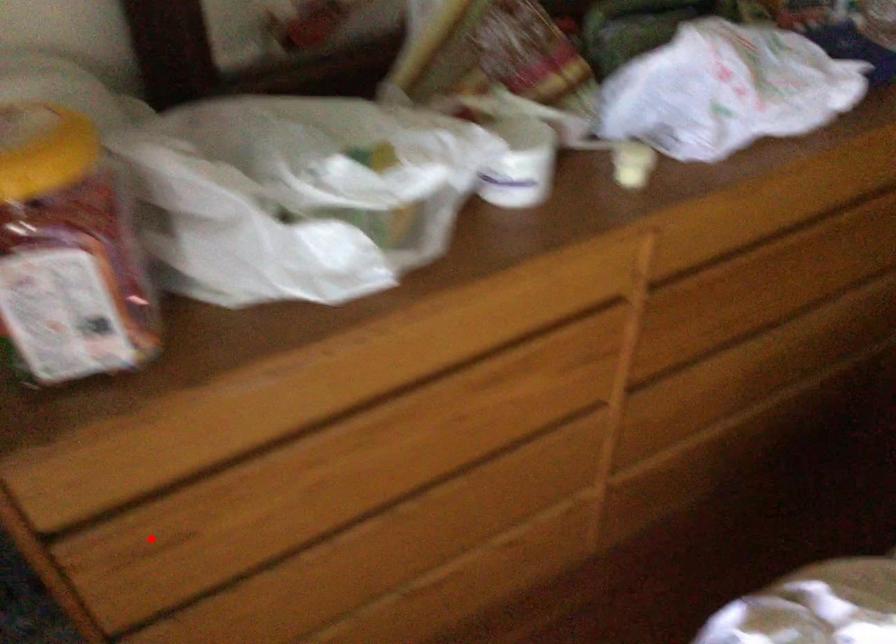
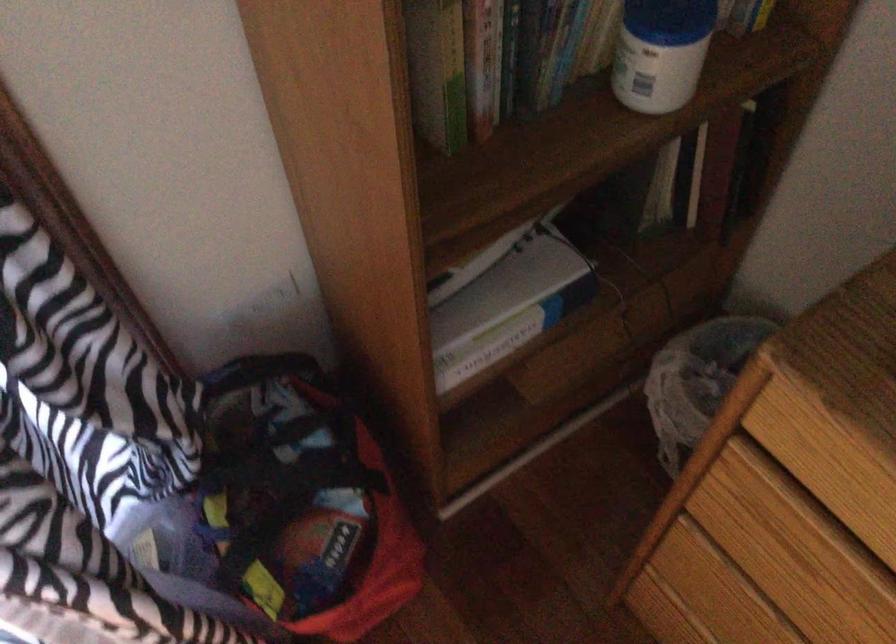
Where in the second image is the point corresponding to the highlighted location from the first image?

(780, 526)